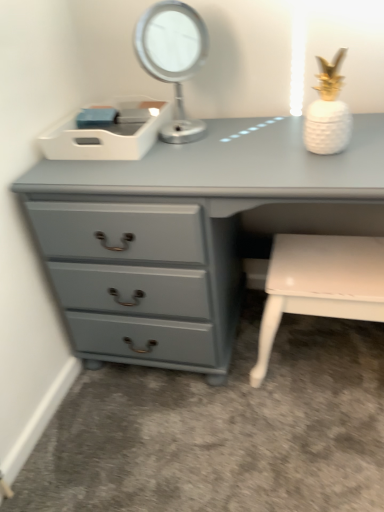
Question: In terms of size, does matte gray chest of drawers at center appear bigger or smaller than metallic silver table lamp at upper center?

Choices:
 (A) big
 (B) small

Answer: (A)

Question: Would you say matte gray chest of drawers at center is inside or outside metallic silver table lamp at upper center?

Choices:
 (A) inside
 (B) outside

Answer: (B)

Question: Estimate the real-world distances between objects in this image. Which object is farther from the matte gray chest of drawers at center?

Choices:
 (A) white glossy bench at lower right
 (B) metallic silver table lamp at upper center

Answer: (A)

Question: Which is farther from the white glossy bench at lower right?

Choices:
 (A) matte gray chest of drawers at center
 (B) metallic silver table lamp at upper center

Answer: (B)